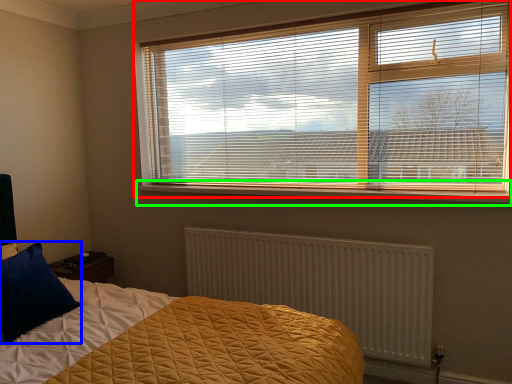
Question: Which object is the closest to the window blind (highlighted by a red box)? Choose among these: pillow (highlighted by a blue box) or window sill (highlighted by a green box).

Choices:
 (A) pillow
 (B) window sill

Answer: (B)